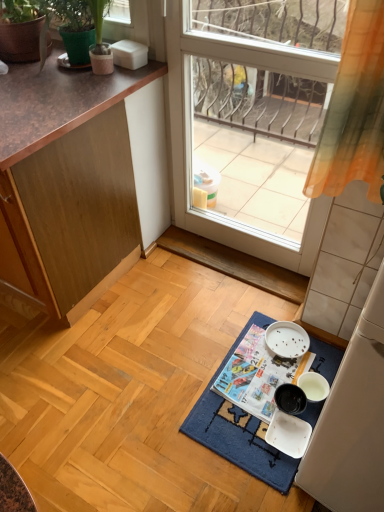
Locate an element on the screen. vacant space situated above blue woven bath mat at center (from a real-world perspective) is located at coordinates (270, 387).